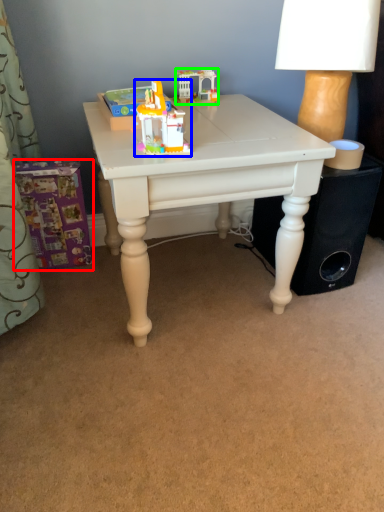
Question: Which object is positioned closest to toy (highlighted by a red box)? Select from toy (highlighted by a blue box) and toy (highlighted by a green box).

Choices:
 (A) toy
 (B) toy

Answer: (A)